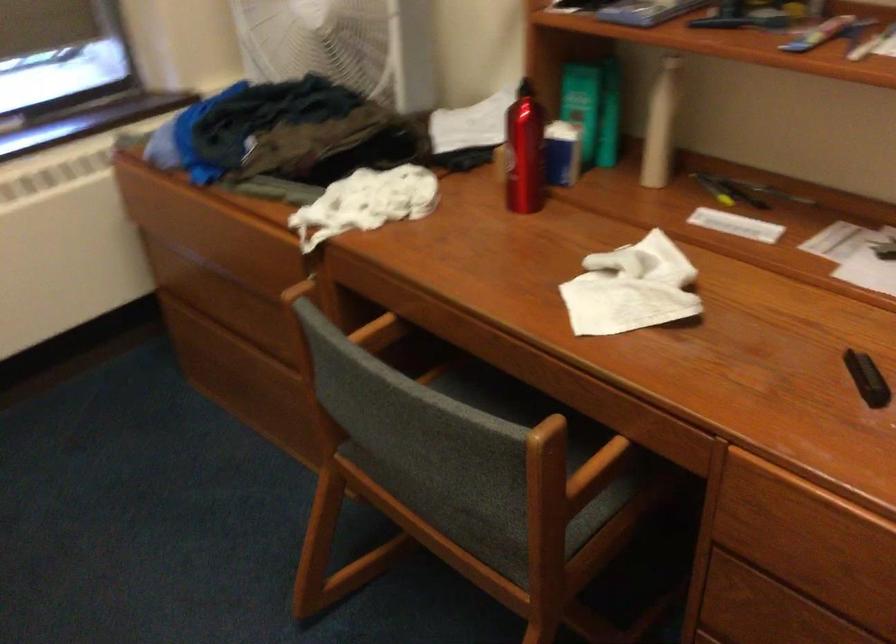
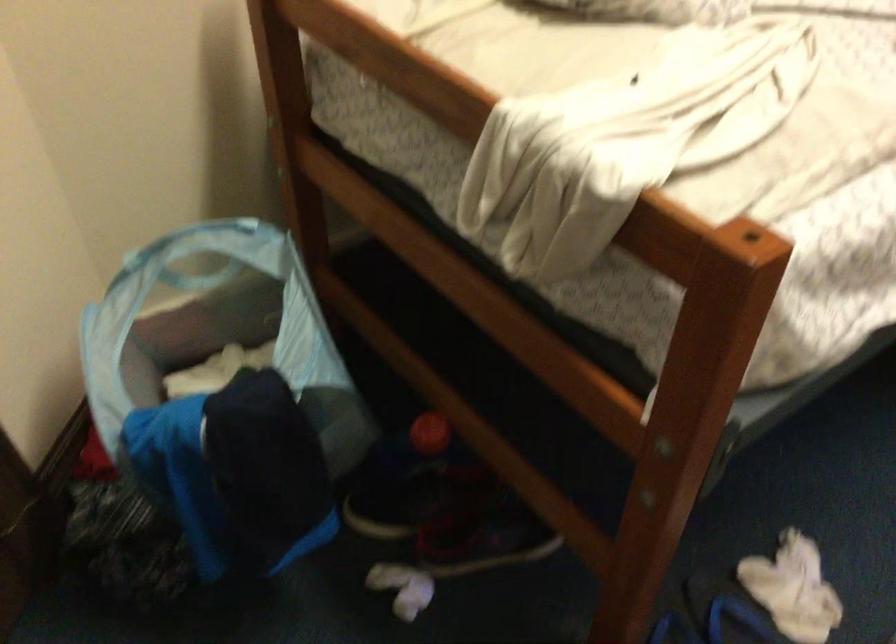
Based on the continuous images, in which direction is the camera rotating?

The camera's rotation is toward left-down.